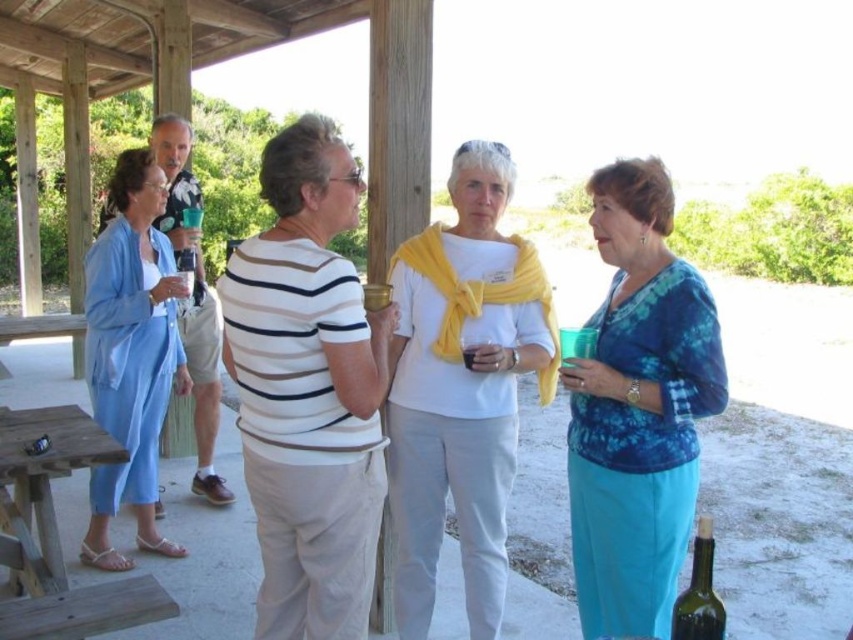
You are a photographer standing at the edge of the pavilion. You want to take a photo of the white matte scarf at center and the camera. How far apart are these two items in feet?

The white matte scarf at center and camera are 7.81 feet apart from each other.

You are standing at the entrance of the pavilion and want to greet the person wearing the white matte scarf at center. Which direction should you walk to reach them?

Walk towards the center of the pavilion to reach the white matte scarf at center.